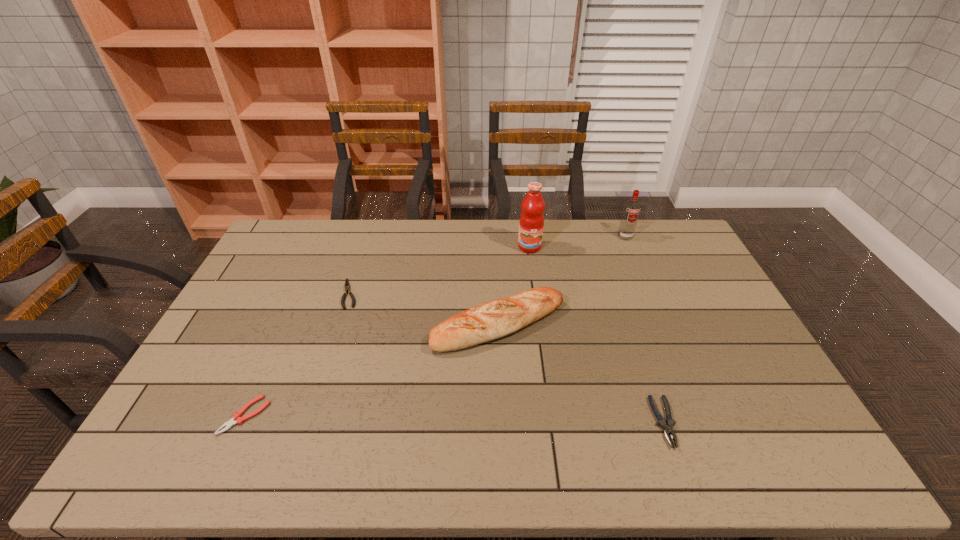
The width and height of the screenshot is (960, 540). Identify the location of blank space located 0.160m on the front label of the vodka. (638, 268).

What are the coordinates of `vacant region located 0.270m on the right of the fourth shortest object` in the screenshot? It's located at (653, 325).

Locate an element on the screen. Image resolution: width=960 pixels, height=540 pixels. free space located on the back of the farthest pliers is located at coordinates (366, 246).

The height and width of the screenshot is (540, 960). I want to click on vacant region located 0.080m on the left of the leftmost pliers, so click(x=193, y=415).

Find the location of a particular element. fruit juice that is at the far edge is located at coordinates (531, 223).

You are a GUI agent. You are given a task and a screenshot of the screen. Output one action in this format:
    pyautogui.click(x=<x>, y=<y>)
    Task: Click on the vodka that is positioned at the far edge
    Image resolution: width=960 pixels, height=540 pixels.
    Given the screenshot: What is the action you would take?
    pyautogui.click(x=631, y=211)

This screenshot has height=540, width=960. I want to click on object at the near edge, so click(x=668, y=429).

Where is `object that is at the left edge`? This screenshot has width=960, height=540. object that is at the left edge is located at coordinates tap(236, 419).

The height and width of the screenshot is (540, 960). In the image, there is a desktop. What are the coordinates of `vacant space at the far edge` in the screenshot? It's located at (628, 249).

Find the location of `vacant space at the near edge of the desktop`. vacant space at the near edge of the desktop is located at coordinates (x=446, y=447).